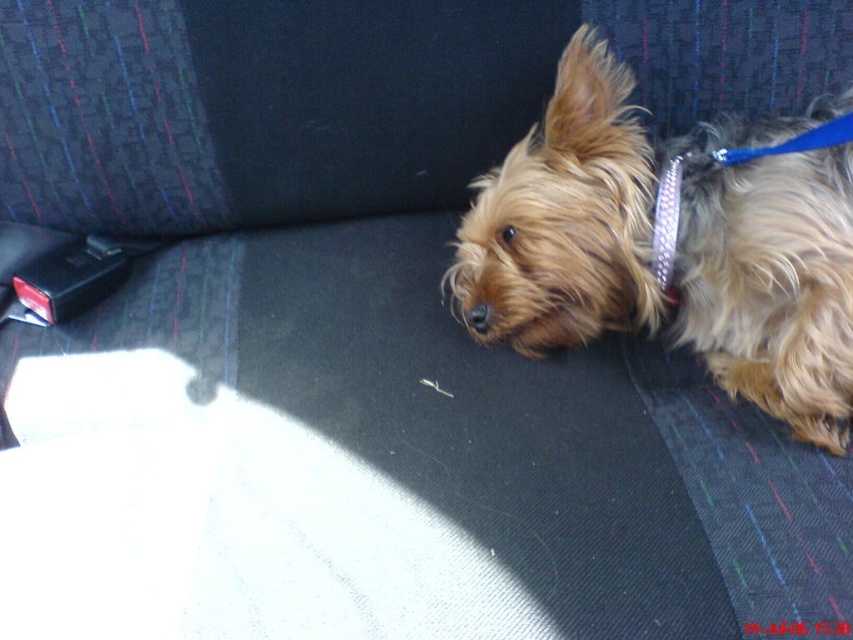
From the picture: Between fuzzy brown dog at center and blue metallic collar at upper right, which one has less height?

With less height is blue metallic collar at upper right.

This screenshot has width=853, height=640. In order to click on fuzzy brown dog at center in this screenshot , I will do `click(676, 244)`.

This screenshot has width=853, height=640. I want to click on fuzzy brown dog at center, so click(676, 244).

Is point (846, 323) farther from viewer compared to point (664, 176)?

No.

Does point (613, 112) lie in front of point (654, 212)?

No, (613, 112) is behind (654, 212).

Between point (550, 308) and point (672, 260), which one is positioned in front?

Point (672, 260)

I want to click on fuzzy brown dog at center, so click(676, 244).

Can you confirm if blue metallic collar at upper right is positioned above glittery silver neckband at upper right?

Yes.

Is point (749, 157) positioned in front of point (674, 221)?

Yes, point (749, 157) is in front of point (674, 221).

You are a GUI agent. You are given a task and a screenshot of the screen. Output one action in this format:
    pyautogui.click(x=<x>, y=<y>)
    Task: Click on the blue metallic collar at upper right
    This screenshot has height=640, width=853.
    Given the screenshot: What is the action you would take?
    pyautogui.click(x=666, y=221)